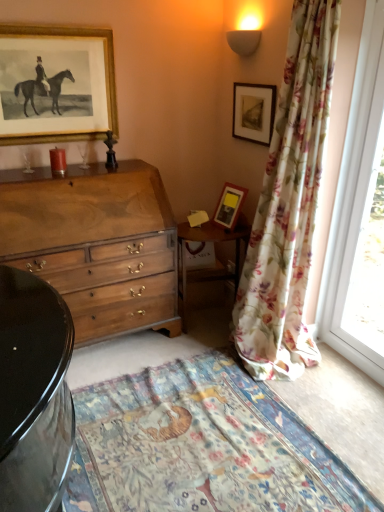
Where is `vacant space in gold-framed print at upper left, the first picture frame from the left (from a real-world perspective)`? This screenshot has height=512, width=384. vacant space in gold-framed print at upper left, the first picture frame from the left (from a real-world perspective) is located at coordinates (43, 163).